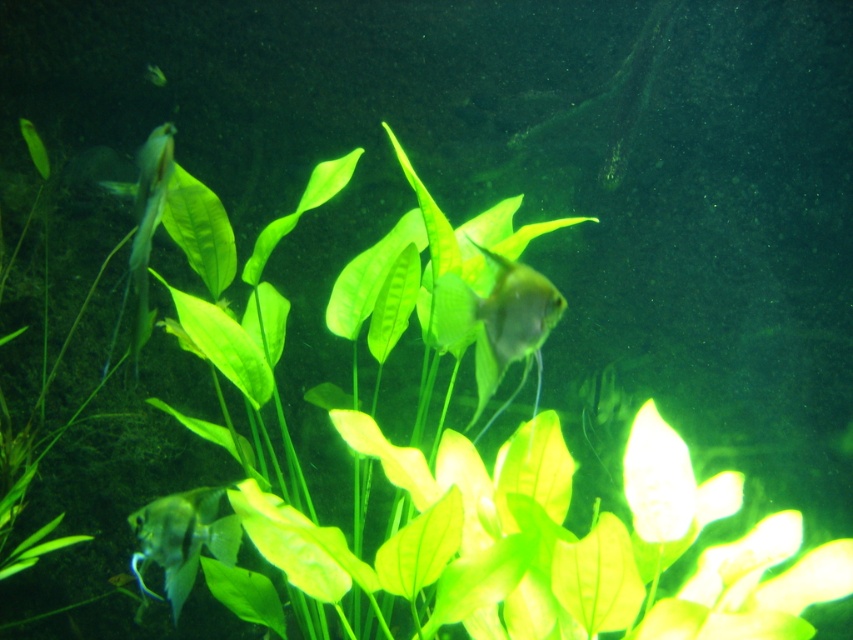
Measure the distance between point [186,524] and camera.

The distance of point [186,524] from camera is 5.51 feet.

Does translucent silver fish at lower left lie behind translucent white fish at left?

Yes, translucent silver fish at lower left is behind translucent white fish at left.

What do you see at coordinates (183, 538) in the screenshot? The height and width of the screenshot is (640, 853). I see `translucent silver fish at lower left` at bounding box center [183, 538].

The image size is (853, 640). I want to click on translucent silver fish at lower left, so click(x=183, y=538).

Between transparent glass fish at center and translucent silver fish at lower left, which one is positioned higher?

Positioned higher is transparent glass fish at center.

Which is behind, point (540, 276) or point (161, 506)?

The point (161, 506) is behind.

Which is behind, point (532, 275) or point (192, 492)?

The point (192, 492) is behind.

Where is `transparent glass fish at center`? transparent glass fish at center is located at coordinates (497, 321).

Does transparent glass fish at center have a greater height compared to translucent white fish at left?

In fact, transparent glass fish at center may be shorter than translucent white fish at left.

Which is behind, point (519, 289) or point (142, 298)?

Positioned behind is point (519, 289).

Is point (537, 301) positioned before point (137, 225)?

Yes.

Where is `transparent glass fish at center`? The width and height of the screenshot is (853, 640). transparent glass fish at center is located at coordinates (497, 321).